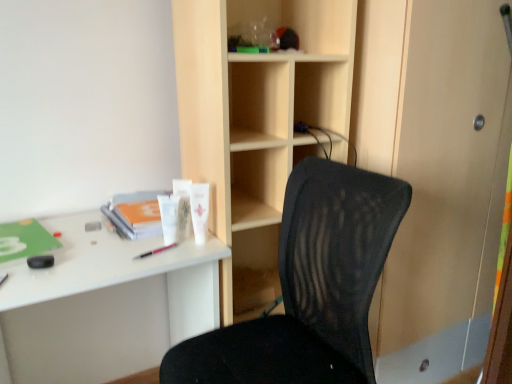
Question: From a real-world perspective, is black mesh chair at center beneath pink plastic pen at center, the second stationery in the top-to-bottom sequence?

Choices:
 (A) no
 (B) yes

Answer: (B)

Question: Can you confirm if black mesh chair at center is shorter than pink plastic pen at center, acting as the 2th stationery starting from the right?

Choices:
 (A) yes
 (B) no

Answer: (B)

Question: Is pink plastic pen at center, acting as the 2th stationery starting from the right, surrounded by black mesh chair at center?

Choices:
 (A) no
 (B) yes

Answer: (A)

Question: Can you confirm if black mesh chair at center is thinner than pink plastic pen at center, acting as the 2th stationery starting from the right?

Choices:
 (A) yes
 (B) no

Answer: (B)

Question: Is black mesh chair at center in contact with pink plastic pen at center, the second stationery in the top-to-bottom sequence?

Choices:
 (A) yes
 (B) no

Answer: (B)

Question: Considering the relative sizes of black mesh chair at center and pink plastic pen at center, the second stationery in the top-to-bottom sequence, in the image provided, is black mesh chair at center taller than pink plastic pen at center, the second stationery in the top-to-bottom sequence,?

Choices:
 (A) no
 (B) yes

Answer: (B)

Question: Is white plastic desk at left facing away from pink plastic pen at center, acting as the 2th stationery starting from the right?

Choices:
 (A) yes
 (B) no

Answer: (B)

Question: Would you say pink plastic pen at center, the second stationery in the top-to-bottom sequence, is part of white plastic desk at left's contents?

Choices:
 (A) no
 (B) yes

Answer: (B)

Question: Does white plastic desk at left have a lesser width compared to pink plastic pen at center, the second stationery in the top-to-bottom sequence?

Choices:
 (A) yes
 (B) no

Answer: (B)

Question: Are white plastic desk at left and pink plastic pen at center, the second stationery in the top-to-bottom sequence, beside each other?

Choices:
 (A) yes
 (B) no

Answer: (B)

Question: Is white plastic desk at left to the left of pink plastic pen at center, which ranks as the first stationery in bottom-to-top order, from the viewer's perspective?

Choices:
 (A) no
 (B) yes

Answer: (B)

Question: From the image's perspective, does white plastic desk at left appear higher than pink plastic pen at center, acting as the 2th stationery starting from the right?

Choices:
 (A) yes
 (B) no

Answer: (B)

Question: From the image's perspective, is white plastic desk at left on black mesh chair at center?

Choices:
 (A) yes
 (B) no

Answer: (B)